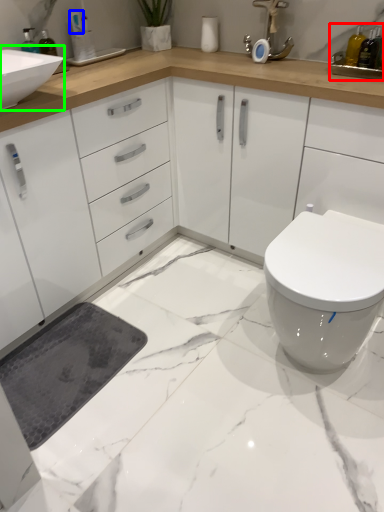
Question: Considering the real-world distances, which object is farthest from sink (highlighted by a red box)? toiletry (highlighted by a blue box) or sink (highlighted by a green box)?

Choices:
 (A) toiletry
 (B) sink

Answer: (A)